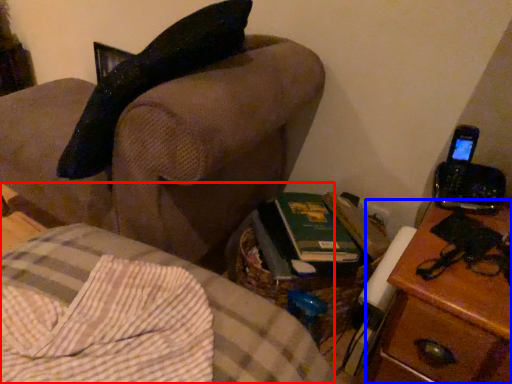
Question: Which object appears closest to the camera in this image, furniture (highlighted by a red box) or nightstand (highlighted by a blue box)?

Choices:
 (A) furniture
 (B) nightstand

Answer: (A)